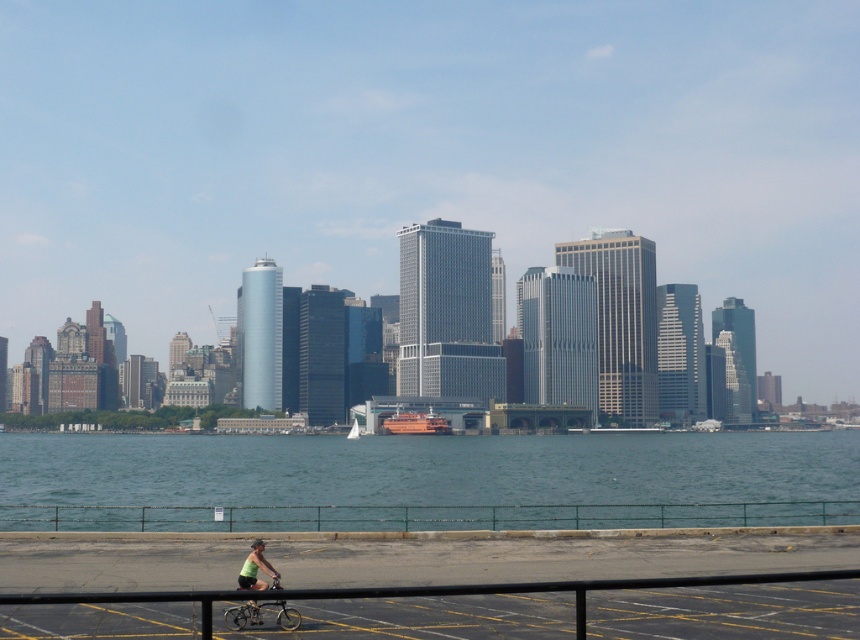
Question: Which of the following is the closest to the observer?

Choices:
 (A) clear blue water at center
 (B) green fabric shirt at lower center

Answer: (B)

Question: Considering the real-world distances, which object is farthest from the clear blue water at center?

Choices:
 (A) green fabric shirt at lower center
 (B) silver metallic bicycle at lower left

Answer: (B)

Question: Does clear blue water at center have a smaller size compared to silver metallic bicycle at lower left?

Choices:
 (A) no
 (B) yes

Answer: (A)

Question: Does clear blue water at center come behind silver metallic bicycle at lower left?

Choices:
 (A) yes
 (B) no

Answer: (A)

Question: Which of the following is the farthest from the observer?

Choices:
 (A) (255, 611)
 (B) (95, 472)
 (C) (258, 538)

Answer: (B)

Question: Does clear blue water at center appear on the right side of silver metallic bicycle at lower left?

Choices:
 (A) yes
 (B) no

Answer: (B)